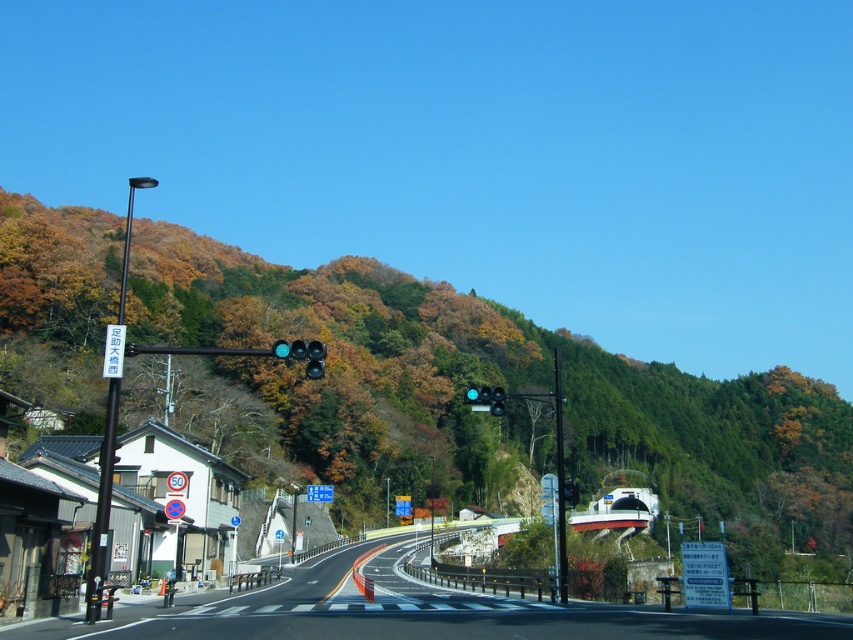
Question: Can you confirm if green leafy hillside at upper center is smaller than matte black traffic light at center?

Choices:
 (A) no
 (B) yes

Answer: (A)

Question: Which point is farther from the camera taking this photo?

Choices:
 (A) (486, 404)
 (B) (22, 243)

Answer: (B)

Question: Which is nearer to the green leafy hillside at upper center?

Choices:
 (A) matte black traffic light at center
 (B) matte black traffic light at upper center

Answer: (A)

Question: Does green leafy hillside at upper center have a lesser width compared to matte black traffic light at center?

Choices:
 (A) yes
 (B) no

Answer: (B)

Question: Is green leafy hillside at upper center smaller than matte black traffic light at center?

Choices:
 (A) yes
 (B) no

Answer: (B)

Question: Which object is the farthest from the matte black traffic light at upper center?

Choices:
 (A) matte black traffic light at center
 (B) green leafy hillside at upper center

Answer: (B)